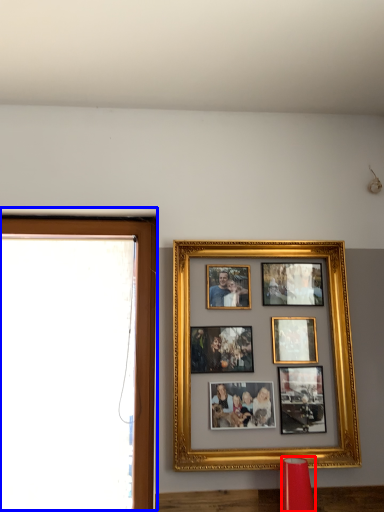
Question: Which object appears closest to the camera in this image, lamp (highlighted by a red box) or window frame (highlighted by a blue box)?

Choices:
 (A) lamp
 (B) window frame

Answer: (A)